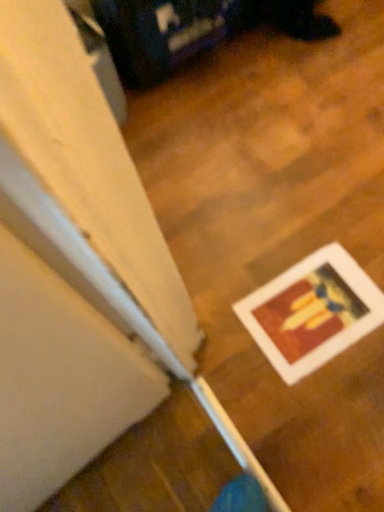
Locate an element on the screen. The width and height of the screenshot is (384, 512). blank area beneath white matte picture frame at lower right (from a real-world perspective) is located at coordinates (310, 309).